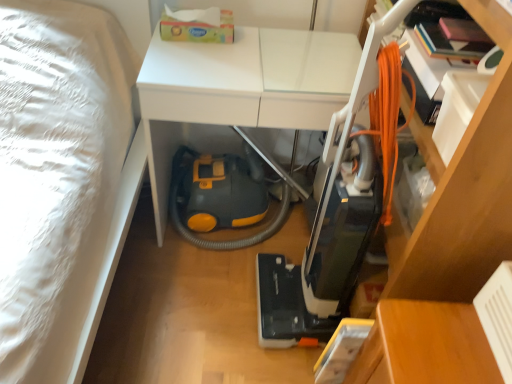
Find the location of a particular element. free space above wooden table at lower right, placed as the 1th table when sorted from bottom to top (from a real-world perspective) is located at coordinates (450, 339).